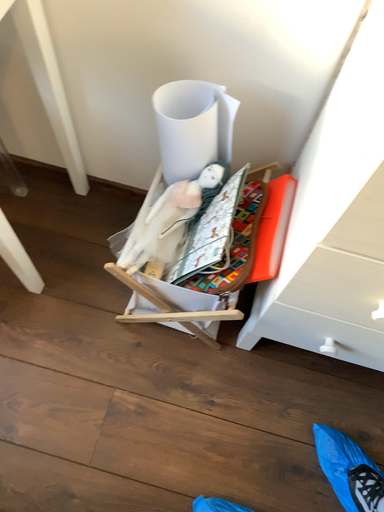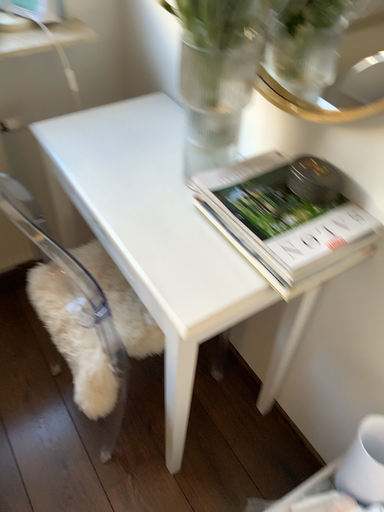
Question: Which way did the camera rotate in the video?

Choices:
 (A) rotated downward
 (B) rotated upward

Answer: (B)